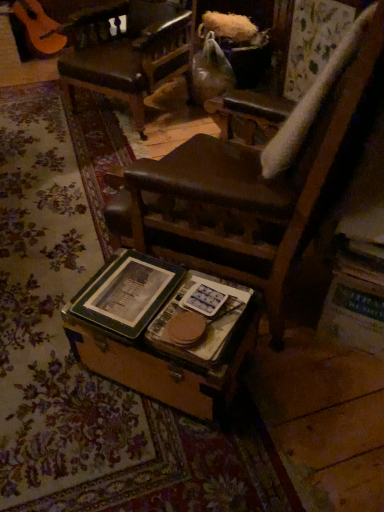
Question: From a real-world perspective, is wooden trunk at center beneath green matte book at center, acting as the 1th paperback book starting from the left?

Choices:
 (A) yes
 (B) no

Answer: (A)

Question: From a real-world perspective, is wooden trunk at center over green matte book at center, arranged as the 2th paperback book when viewed from the right?

Choices:
 (A) yes
 (B) no

Answer: (B)

Question: Is wooden trunk at center smaller than green matte book at center, arranged as the 2th paperback book when viewed from the right?

Choices:
 (A) yes
 (B) no

Answer: (B)

Question: From the image's perspective, would you say wooden trunk at center is shown under green matte book at center, arranged as the 2th paperback book when viewed from the right?

Choices:
 (A) yes
 (B) no

Answer: (A)

Question: From the image's perspective, would you say wooden trunk at center is positioned over green matte book at center, arranged as the 2th paperback book when viewed from the right?

Choices:
 (A) no
 (B) yes

Answer: (A)

Question: Is wooden trunk at center taller or shorter than green matte book at center, acting as the 1th paperback book starting from the left?

Choices:
 (A) tall
 (B) short

Answer: (A)

Question: From a real-world perspective, is wooden trunk at center physically located above or below green matte book at center, arranged as the 2th paperback book when viewed from the right?

Choices:
 (A) above
 (B) below

Answer: (B)

Question: Is wooden trunk at center inside the boundaries of green matte book at center, arranged as the 2th paperback book when viewed from the right, or outside?

Choices:
 (A) outside
 (B) inside

Answer: (A)

Question: Looking at their shapes, would you say wooden trunk at center is wider or thinner than green matte book at center, acting as the 1th paperback book starting from the left?

Choices:
 (A) wide
 (B) thin

Answer: (A)

Question: In the image, is hardcover book at center, the first paperback book viewed from the right, positioned in front of or behind green matte book at center, arranged as the 2th paperback book when viewed from the right?

Choices:
 (A) behind
 (B) front

Answer: (B)

Question: Based on their positions, is hardcover book at center, marked as the 2th paperback book in a left-to-right arrangement, located to the left or right of green matte book at center, acting as the 1th paperback book starting from the left?

Choices:
 (A) left
 (B) right

Answer: (B)

Question: Is point (228, 349) positioned closer to the camera than point (130, 293)?

Choices:
 (A) farther
 (B) closer

Answer: (B)

Question: From their relative heights in the image, would you say hardcover book at center, marked as the 2th paperback book in a left-to-right arrangement, is taller or shorter than green matte book at center, acting as the 1th paperback book starting from the left?

Choices:
 (A) short
 (B) tall

Answer: (A)

Question: From the image's perspective, relative to leather seat at center, is green matte book at center, arranged as the 2th paperback book when viewed from the right, above or below?

Choices:
 (A) above
 (B) below

Answer: (B)

Question: Is green matte book at center, acting as the 1th paperback book starting from the left, taller or shorter than leather seat at center?

Choices:
 (A) tall
 (B) short

Answer: (B)